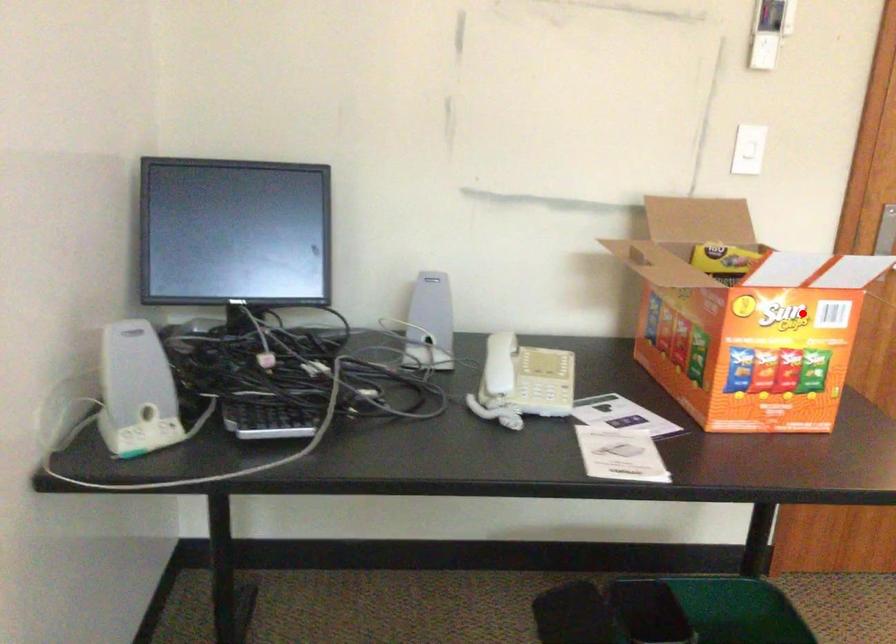
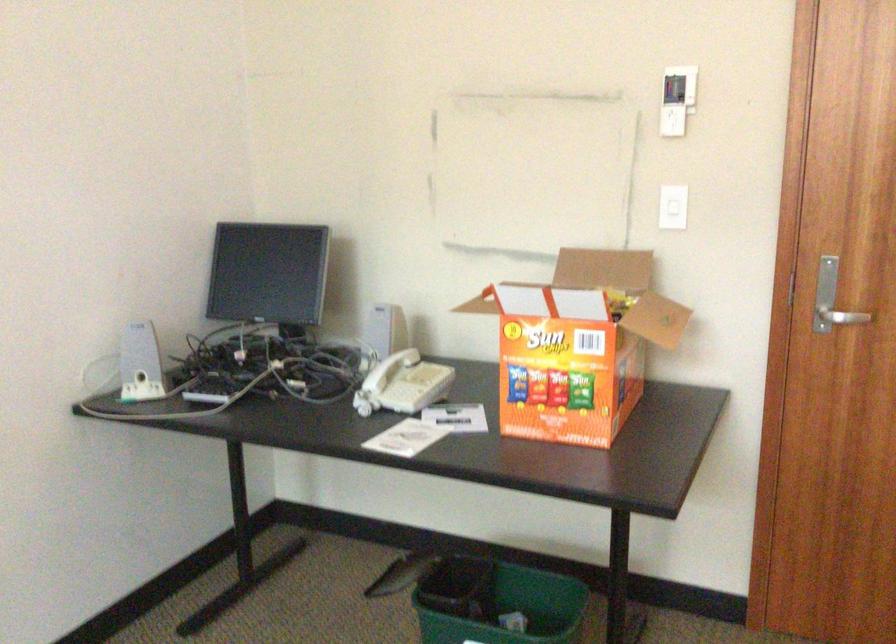
Where in the second image is the point corresponding to the highlighted location from the first image?

(578, 345)